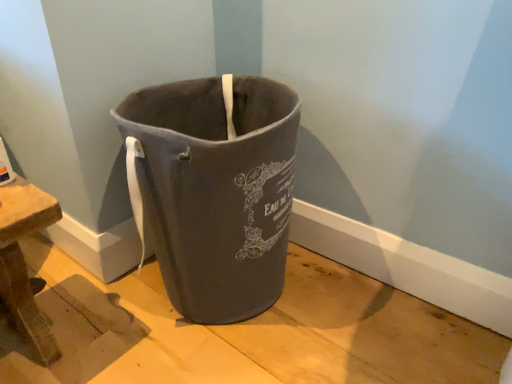
In order to click on vacant area to the left of matte gray fabric bucket at center in this screenshot , I will do `click(75, 311)`.